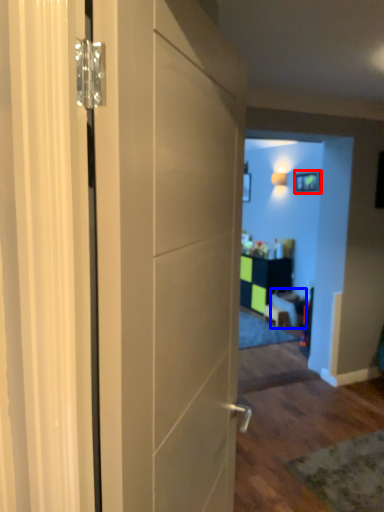
Question: Which object appears closest to the camera in this image, picture frame (highlighted by a red box) or furniture (highlighted by a blue box)?

Choices:
 (A) picture frame
 (B) furniture

Answer: (B)